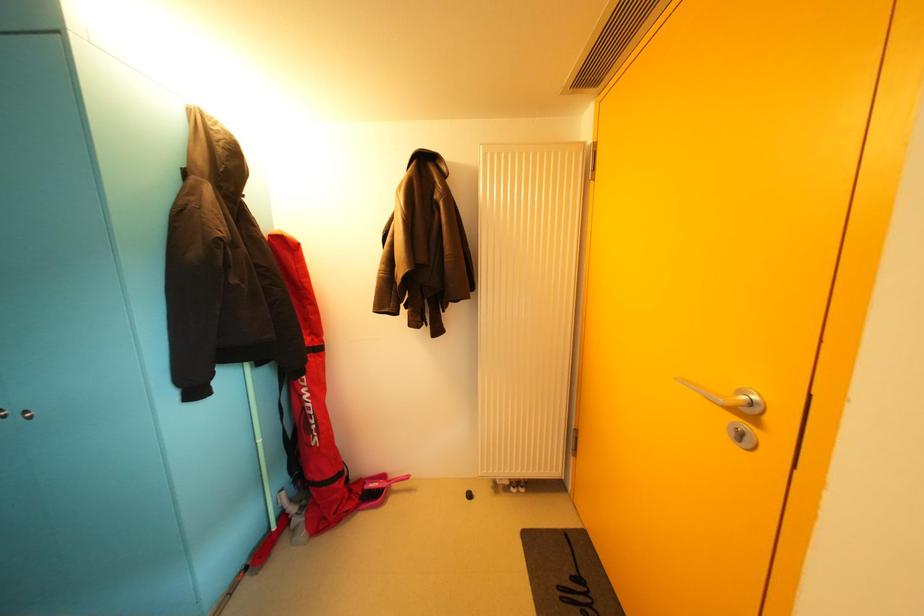
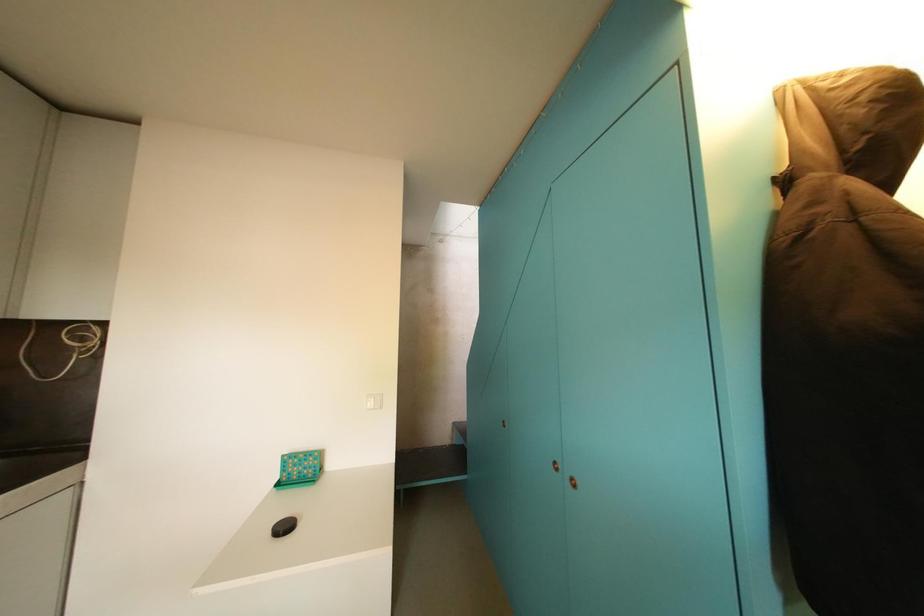
Question: The camera is either moving clockwise (left) or counter-clockwise (right) around the object. The first image is from the beginning of the video and the second image is from the end. Is the camera moving left or right when shooting the video?

Choices:
 (A) Left
 (B) Right

Answer: (B)